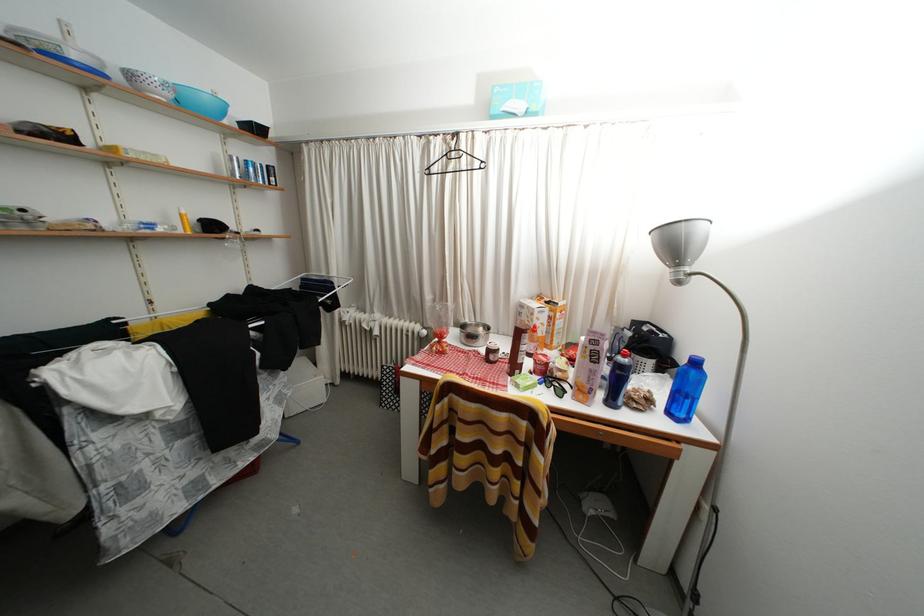
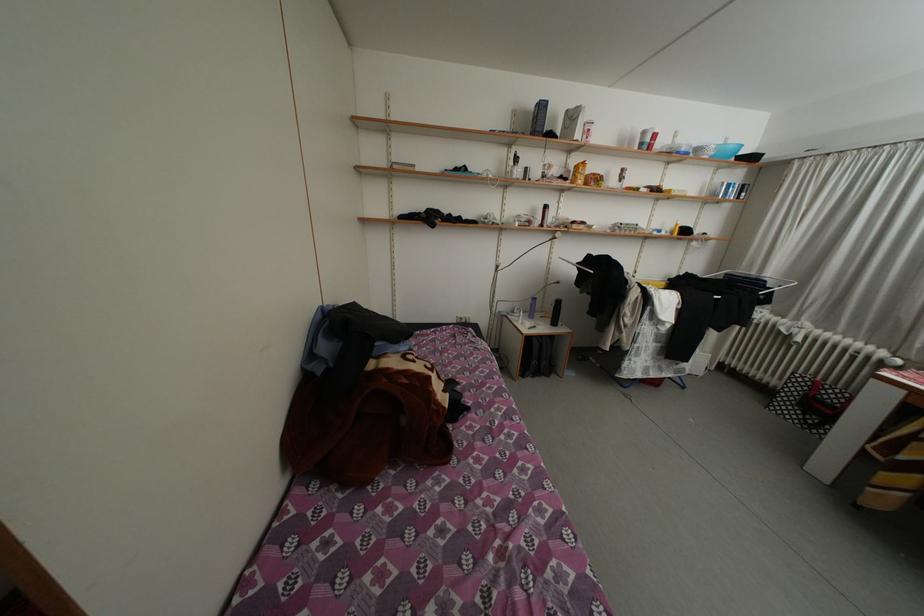
Locate, in the second image, the point that corresponds to point (178, 100) in the first image.

(721, 159)